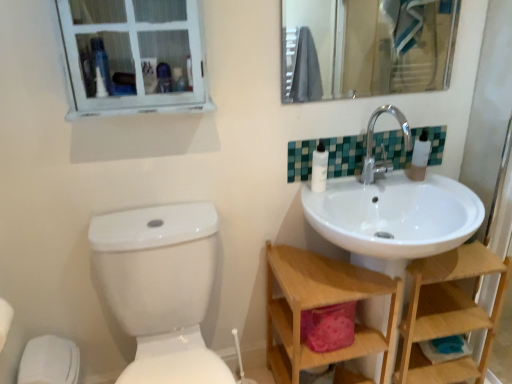
Question: Considering the relative positions of white wooden window at upper left and clear glass mirror at upper center in the image provided, is white wooden window at upper left to the right of clear glass mirror at upper center from the viewer's perspective?

Choices:
 (A) no
 (B) yes

Answer: (A)

Question: Considering the relative positions of white wooden window at upper left and clear glass mirror at upper center in the image provided, is white wooden window at upper left to the left of clear glass mirror at upper center from the viewer's perspective?

Choices:
 (A) no
 (B) yes

Answer: (B)

Question: Is the depth of white wooden window at upper left less than that of clear glass mirror at upper center?

Choices:
 (A) yes
 (B) no

Answer: (A)

Question: Does white wooden window at upper left have a greater height compared to clear glass mirror at upper center?

Choices:
 (A) yes
 (B) no

Answer: (B)

Question: Is white wooden window at upper left turned away from clear glass mirror at upper center?

Choices:
 (A) yes
 (B) no

Answer: (B)

Question: Is the position of white wooden window at upper left more distant than that of clear glass mirror at upper center?

Choices:
 (A) no
 (B) yes

Answer: (A)

Question: Can you confirm if white plastic bottles at upper right is positioned to the left of white glossy toilet at lower left?

Choices:
 (A) no
 (B) yes

Answer: (A)

Question: From a real-world perspective, is white plastic bottles at upper right physically above white glossy toilet at lower left?

Choices:
 (A) no
 (B) yes

Answer: (B)

Question: Considering the relative positions of white plastic bottles at upper right and white glossy toilet at lower left in the image provided, is white plastic bottles at upper right to the right of white glossy toilet at lower left from the viewer's perspective?

Choices:
 (A) no
 (B) yes

Answer: (B)

Question: Is white plastic bottles at upper right completely or partially outside of white glossy toilet at lower left?

Choices:
 (A) no
 (B) yes

Answer: (B)

Question: Does white plastic bottles at upper right lie behind white glossy toilet at lower left?

Choices:
 (A) no
 (B) yes

Answer: (B)

Question: Is there a large distance between white plastic bottles at upper right and white glossy toilet at lower left?

Choices:
 (A) yes
 (B) no

Answer: (B)

Question: Is wooden at right, the second shelf positioned from the left, far away from wooden shelf at lower right, placed as the 1th shelf when sorted from left to right?

Choices:
 (A) yes
 (B) no

Answer: (B)